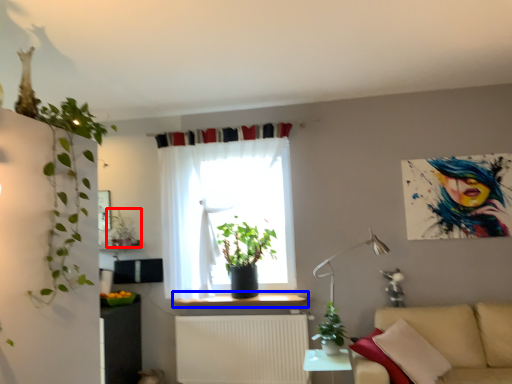
Question: Which point is further to the camera, houseplant (highlighted by a red box) or window sill (highlighted by a blue box)?

Choices:
 (A) houseplant
 (B) window sill

Answer: (A)